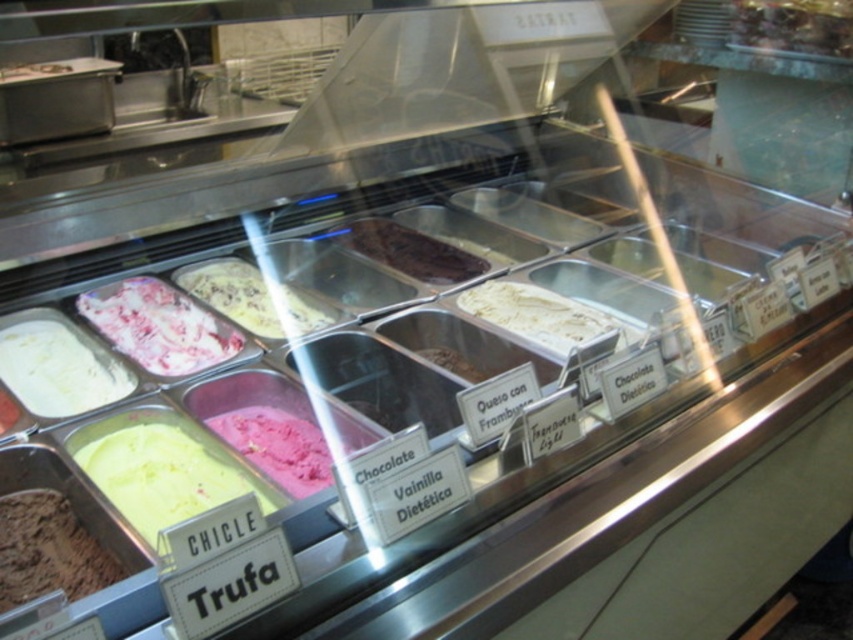
You are standing in front of the ice cream display case and want to point out two specific points inside the case. The first point is labeled as point 1 at coordinates (312, 326), and the second point is labeled as point 2 at coordinates (404, 269). From your perspective, which point is closer to you?

Point 1 at coordinates (312, 326) is closer to you because it is in front of point 2 at coordinates (404, 269).

You are at an ice cream shop and want to choose between the pink creamy ice cream at center and the chocolatesmoothice cream at center. Which one is bigger?

The pink creamy ice cream at center is larger than the chocolatesmoothice cream at center.